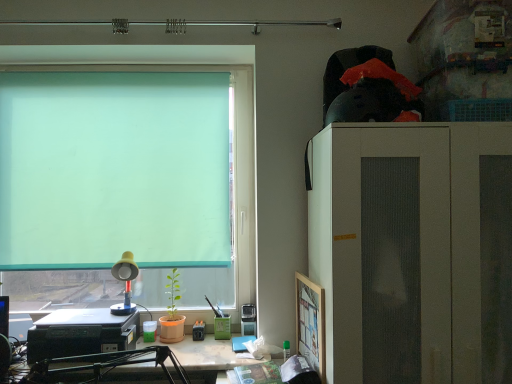
Identify the location of free space to the left of yellow plastic lamp at lower left. The height and width of the screenshot is (384, 512). (91, 313).